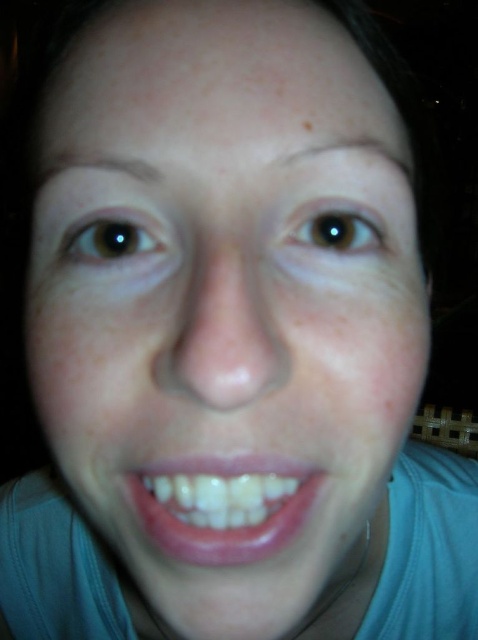
You are a photographer trying to capture the perfect shot of the person in the image. You need to ensure that the glossy pink lips at center and the brown matte eye at upper left are both visible in the frame. Given their sizes, which object should you focus on to ensure both are in focus?

The glossy pink lips at center is bigger than the brown matte eye at upper left, so focusing on the glossy pink lips at center will help ensure both are in focus since it is larger and likely easier to capture clearly.

You are a photographer adjusting your camera settings for a portrait. The subject has a brown matte eye at upper center. If your camera requires the subject to be at least 30 centimeters away to avoid overexposure, is the current distance sufficient?

The brown matte eye at upper center is currently 22.41 centimeters away from the camera, which is less than the required 30 centimeters. To avoid overexposure, the subject should move further away to meet the minimum distance requirement.

What are the coordinates of the brown matte eye at upper center in the image?

The brown matte eye at upper center is located at point (336, 227).